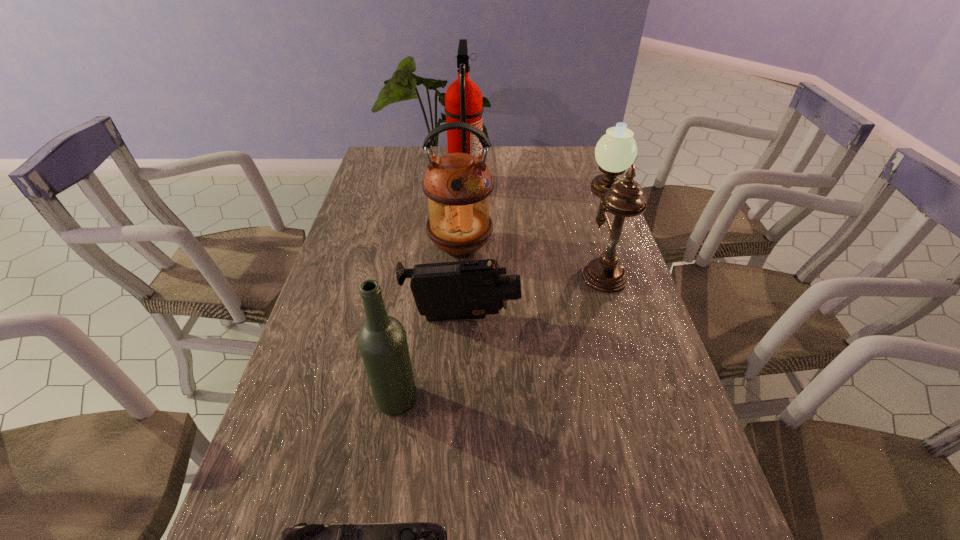
The height and width of the screenshot is (540, 960). What are the coordinates of `vacant space located 0.400m on the right of the wine bottle` in the screenshot? It's located at (598, 401).

Identify the location of free space located 0.220m on the front-facing side of the farther camcorder. This screenshot has height=540, width=960. (604, 318).

You are a GUI agent. You are given a task and a screenshot of the screen. Output one action in this format:
    pyautogui.click(x=<x>, y=<y>)
    Task: Click on the object that is at the far edge
    The height and width of the screenshot is (540, 960).
    Given the screenshot: What is the action you would take?
    pyautogui.click(x=463, y=100)

Image resolution: width=960 pixels, height=540 pixels. I want to click on object located in the right edge section of the desktop, so click(x=616, y=151).

Where is `free space at the far edge of the desktop`? This screenshot has height=540, width=960. free space at the far edge of the desktop is located at coordinates (535, 150).

You are a GUI agent. You are given a task and a screenshot of the screen. Output one action in this format:
    pyautogui.click(x=<x>, y=<y>)
    Task: Click on the vacant space at the left edge
    This screenshot has width=960, height=540.
    Given the screenshot: What is the action you would take?
    (x=374, y=201)

In the image, there is a desktop. At what (x,y) coordinates should I click in order to perform the action: click on free space at the right edge. Please return your answer as a coordinate pair (x, y). Looking at the image, I should click on (561, 192).

Identify the location of vacant space at the far right corner of the desktop. The height and width of the screenshot is (540, 960). (556, 157).

What are the coordinates of `vacant region between the rightmost object and the second nearest object` in the screenshot? It's located at (498, 332).

You are a GUI agent. You are given a task and a screenshot of the screen. Output one action in this format:
    pyautogui.click(x=<x>, y=<y>)
    Task: Click on the unoccupied area between the left oil lamp and the right oil lamp
    This screenshot has width=960, height=540.
    Given the screenshot: What is the action you would take?
    pyautogui.click(x=530, y=255)